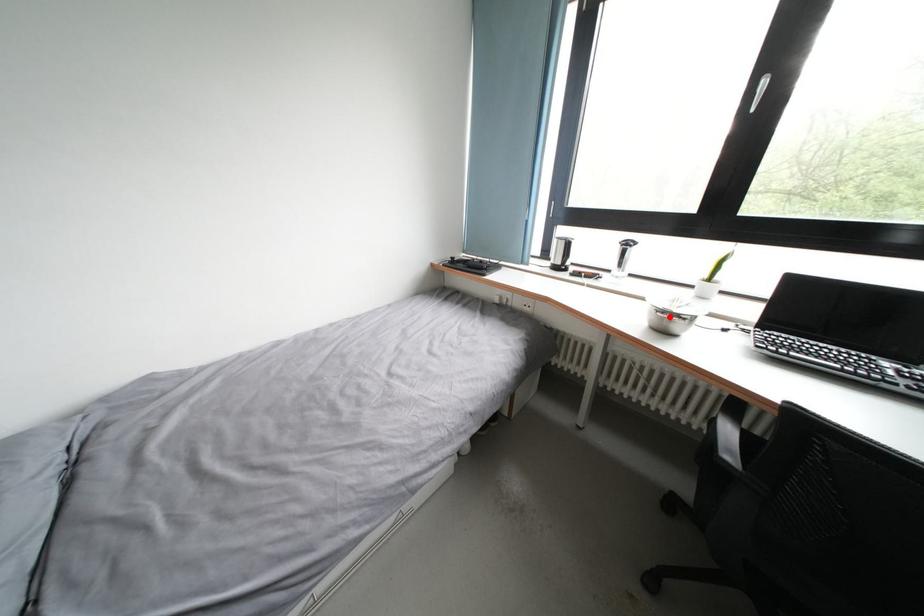
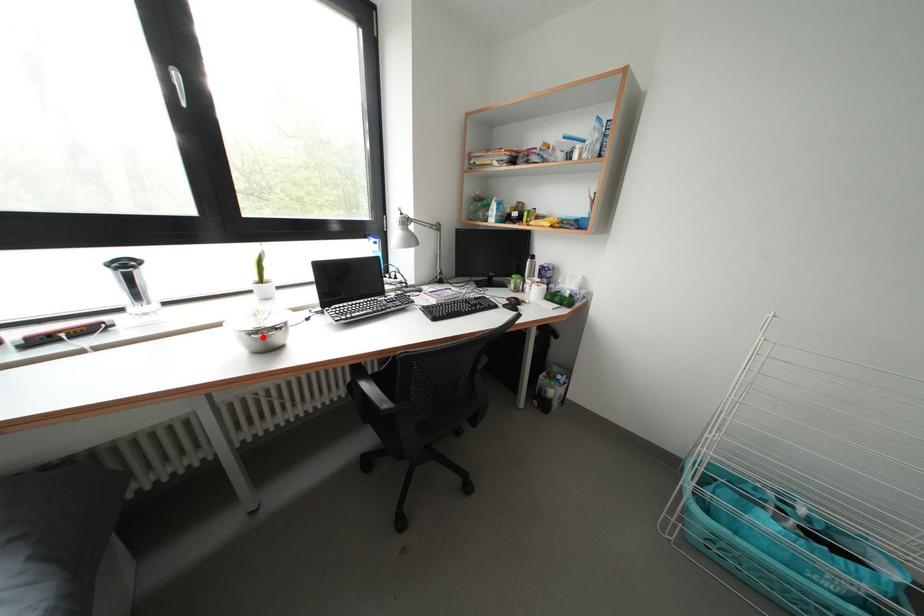
I am providing you with two images of the same scene from different viewpoints. A red point is marked on the first image and another point is marked on the second image. Is the marked point in image1 the same physical position as the marked point in image2?

Yes